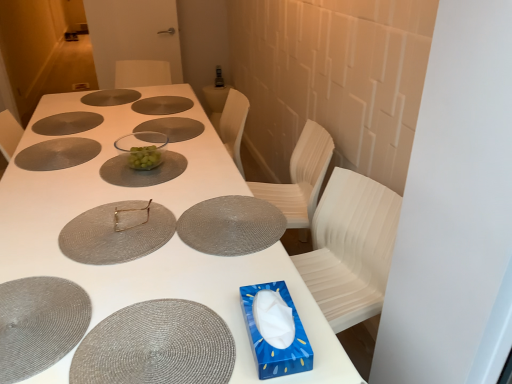
Identify the location of vacant area that is in front of matte gray glass plate at upper center, which is the 9th glass plate from front to back. (99, 107).